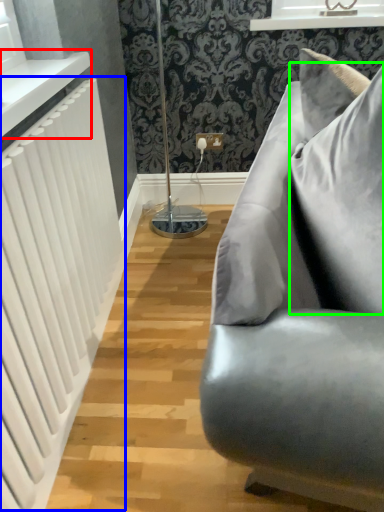
Question: Which object is the closest to the window sill (highlighted by a red box)? Choose among these: radiator (highlighted by a blue box) or pillow (highlighted by a green box).

Choices:
 (A) radiator
 (B) pillow

Answer: (A)